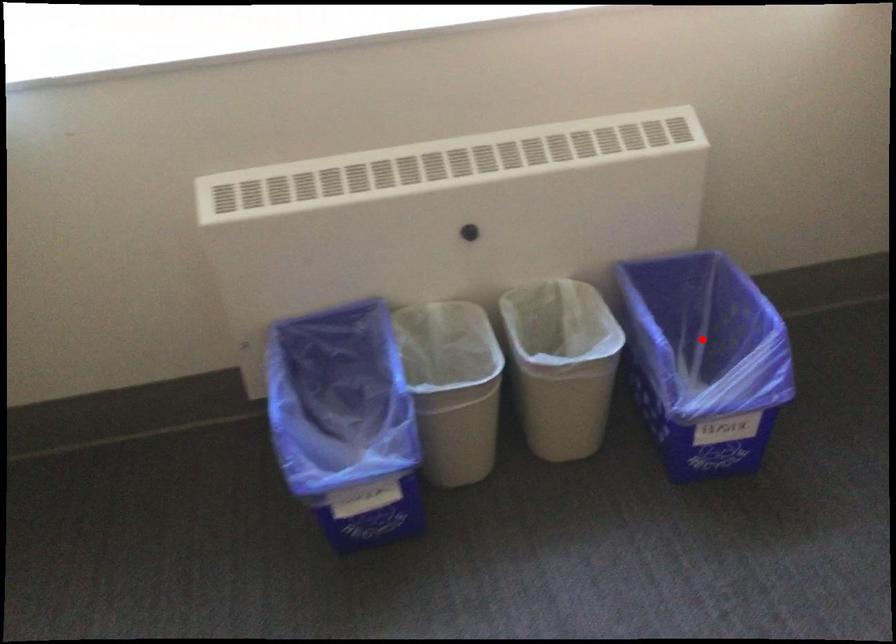
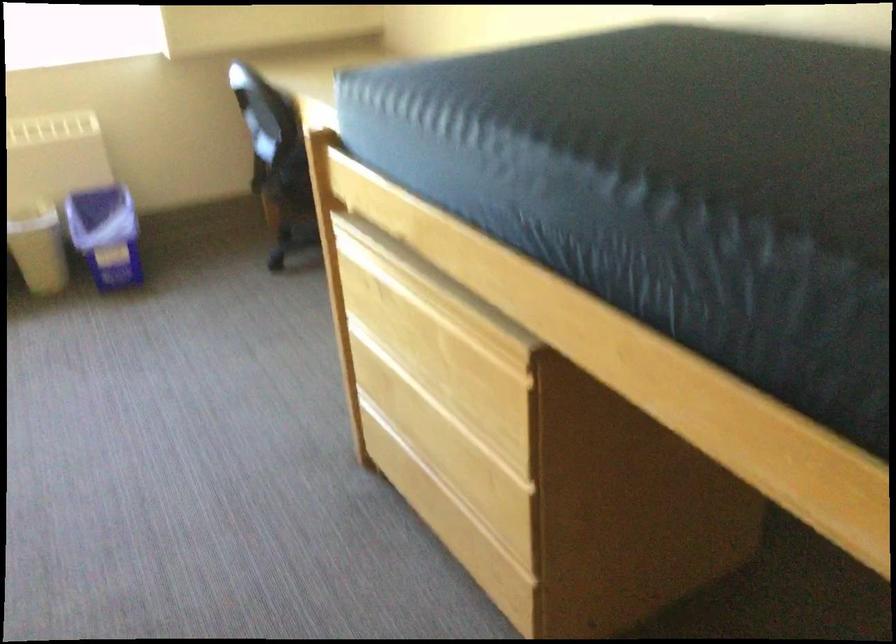
Question: I am providing you with two images of the same scene from different viewpoints. A red point is marked on the first image. Is the red point's position out of view in image 2?

Choices:
 (A) Yes
 (B) No

Answer: (A)